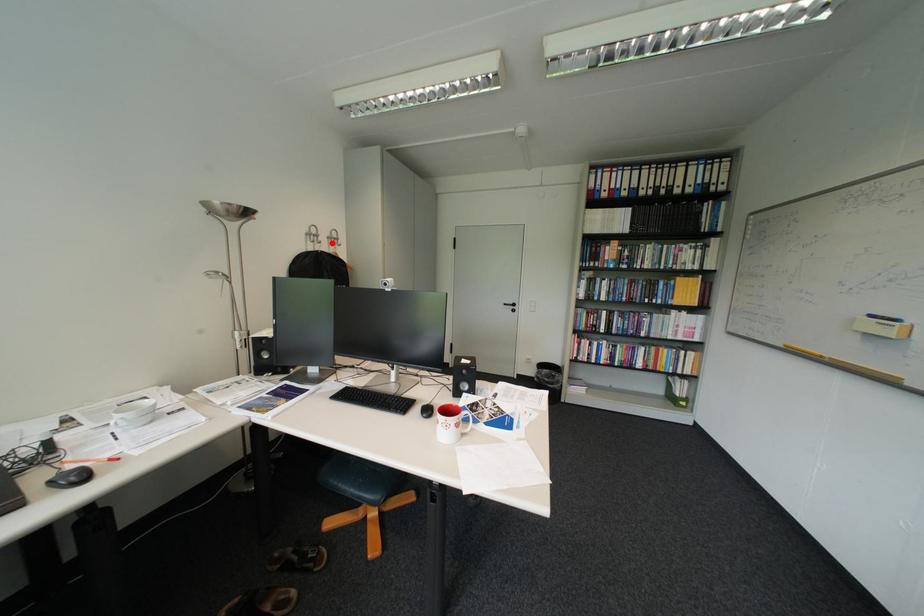
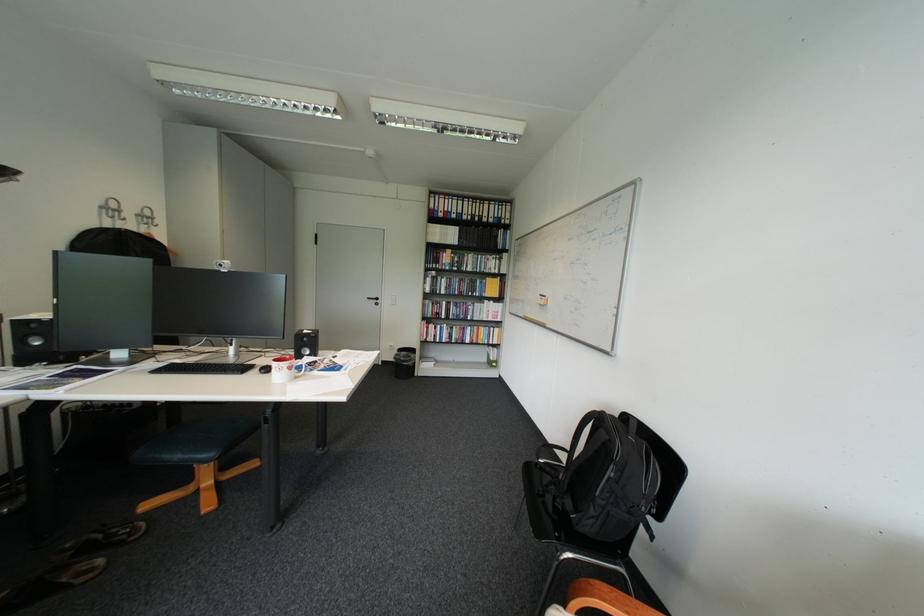
Where in the second image is the point corresponding to the highlighted location from the first image?

(137, 220)